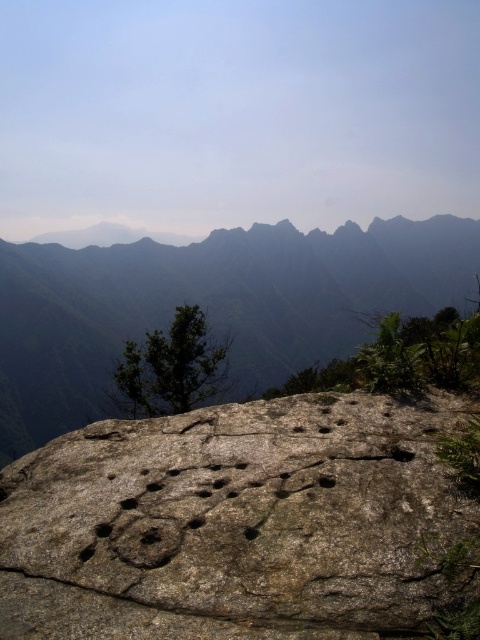
Is gray rough boulder at center behind gray rough rock at center?

That is False.

Does gray rough boulder at center have a lesser height compared to gray rough rock at center?

Yes, gray rough boulder at center is shorter than gray rough rock at center.

Between point (402, 600) and point (21, 326), which one is positioned behind?

Positioned behind is point (21, 326).

This screenshot has height=640, width=480. What are the coordinates of `gray rough boulder at center` in the screenshot? It's located at (237, 524).